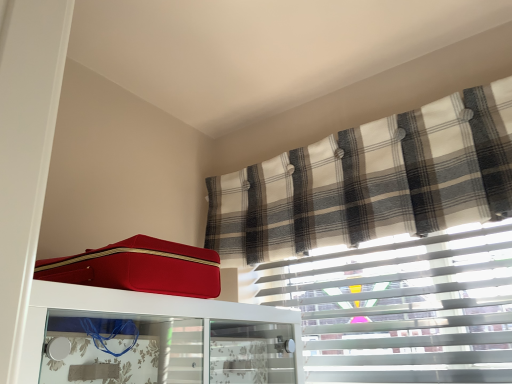
Question: Considering the relative positions of matte red suitcase at upper left and plaid fabric curtain at upper right in the image provided, is matte red suitcase at upper left to the right of plaid fabric curtain at upper right from the viewer's perspective?

Choices:
 (A) no
 (B) yes

Answer: (A)

Question: Is the position of matte red suitcase at upper left more distant than that of plaid fabric curtain at upper right?

Choices:
 (A) yes
 (B) no

Answer: (B)

Question: From a real-world perspective, is matte red suitcase at upper left physically below plaid fabric curtain at upper right?

Choices:
 (A) no
 (B) yes

Answer: (B)

Question: Is matte red suitcase at upper left turned away from plaid fabric curtain at upper right?

Choices:
 (A) no
 (B) yes

Answer: (A)

Question: From the image's perspective, does matte red suitcase at upper left appear higher than plaid fabric curtain at upper right?

Choices:
 (A) yes
 (B) no

Answer: (B)

Question: Is plaid fabric curtain at upper right situated inside matte red suitcase at upper left or outside?

Choices:
 (A) outside
 (B) inside

Answer: (A)

Question: Based on their positions, is plaid fabric curtain at upper right located to the left or right of matte red suitcase at upper left?

Choices:
 (A) left
 (B) right

Answer: (B)

Question: From a real-world perspective, is plaid fabric curtain at upper right positioned above or below matte red suitcase at upper left?

Choices:
 (A) below
 (B) above

Answer: (B)

Question: Looking at the image, does plaid fabric curtain at upper right seem bigger or smaller compared to matte red suitcase at upper left?

Choices:
 (A) small
 (B) big

Answer: (B)

Question: Is matte red suitcase at upper left to the left or to the right of matte red suitcase at upper left in the image?

Choices:
 (A) right
 (B) left

Answer: (B)

Question: From the image's perspective, is matte red suitcase at upper left positioned above or below matte red suitcase at upper left?

Choices:
 (A) below
 (B) above

Answer: (A)

Question: From a real-world perspective, is matte red suitcase at upper left positioned above or below matte red suitcase at upper left?

Choices:
 (A) above
 (B) below

Answer: (B)

Question: Is matte red suitcase at upper left spatially inside matte red suitcase at upper left, or outside of it?

Choices:
 (A) outside
 (B) inside

Answer: (A)

Question: From their relative heights in the image, would you say plaid fabric curtain at upper right is taller or shorter than matte red suitcase at upper left?

Choices:
 (A) tall
 (B) short

Answer: (A)

Question: In the image, is plaid fabric curtain at upper right positioned in front of or behind matte red suitcase at upper left?

Choices:
 (A) front
 (B) behind

Answer: (B)